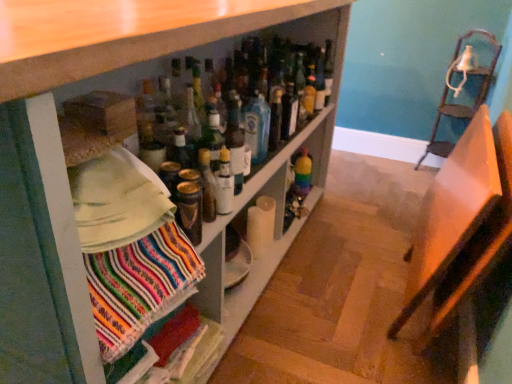
Question: Is clear glass bottle at center, which is the second bottle from left to right, oriented away from metallic gold can at center, which is the fourth bottle in right-to-left order?

Choices:
 (A) no
 (B) yes

Answer: (A)

Question: Is clear glass bottle at center, which is counted as the second bottle, starting from the front, smaller than metallic gold can at center, which ranks as the 4th bottle in back-to-front order?

Choices:
 (A) no
 (B) yes

Answer: (A)

Question: Are clear glass bottle at center, acting as the third bottle starting from the back, and metallic gold can at center, which ranks as the 4th bottle in back-to-front order, located far from each other?

Choices:
 (A) no
 (B) yes

Answer: (A)

Question: Is clear glass bottle at center, which is the second bottle from left to right, in contact with metallic gold can at center, which is counted as the 1th bottle, starting from the front?

Choices:
 (A) yes
 (B) no

Answer: (B)

Question: Considering the relative sizes of clear glass bottle at center, acting as the third bottle starting from the back, and metallic gold can at center, which ranks as the 4th bottle in back-to-front order, in the image provided, is clear glass bottle at center, acting as the third bottle starting from the back, shorter than metallic gold can at center, which ranks as the 4th bottle in back-to-front order,?

Choices:
 (A) yes
 (B) no

Answer: (B)

Question: In terms of size, does rainbow glass bottle at center, arranged as the 4th bottle when viewed from the left, appear bigger or smaller than multicolored woven cloth at lower left?

Choices:
 (A) small
 (B) big

Answer: (A)

Question: Which is correct: rainbow glass bottle at center, the 4th bottle viewed from the front, is inside multicolored woven cloth at lower left, or outside of it?

Choices:
 (A) inside
 (B) outside

Answer: (B)

Question: In the image, is rainbow glass bottle at center, arranged as the 4th bottle when viewed from the left, positioned in front of or behind multicolored woven cloth at lower left?

Choices:
 (A) behind
 (B) front

Answer: (A)

Question: Looking at their shapes, would you say rainbow glass bottle at center, which is the first bottle from right to left, is wider or thinner than multicolored woven cloth at lower left?

Choices:
 (A) thin
 (B) wide

Answer: (A)

Question: Relative to black glass bottle at center, which appears as the 3th bottle when viewed from the front, is metallic silver chair at upper right, which is the 2th chair from left to right, in front or behind?

Choices:
 (A) behind
 (B) front

Answer: (A)

Question: Considering the relative positions of metallic silver chair at upper right, which is counted as the first chair, starting from the back, and black glass bottle at center, acting as the third bottle starting from the left, in the image provided, is metallic silver chair at upper right, which is counted as the first chair, starting from the back, to the left or to the right of black glass bottle at center, acting as the third bottle starting from the left,?

Choices:
 (A) left
 (B) right

Answer: (B)

Question: Is point (432, 147) closer or farther from the camera than point (290, 115)?

Choices:
 (A) closer
 (B) farther

Answer: (B)

Question: Would you say metallic silver chair at upper right, marked as the second chair in a front-to-back arrangement, is inside or outside black glass bottle at center, acting as the third bottle starting from the left?

Choices:
 (A) inside
 (B) outside

Answer: (B)

Question: Is wooden chair at right, the second chair positioned from the right, bigger or smaller than blue glass bottle at center?

Choices:
 (A) small
 (B) big

Answer: (B)

Question: Would you say wooden chair at right, the second chair positioned from the right, is to the left or to the right of blue glass bottle at center in the picture?

Choices:
 (A) right
 (B) left

Answer: (A)